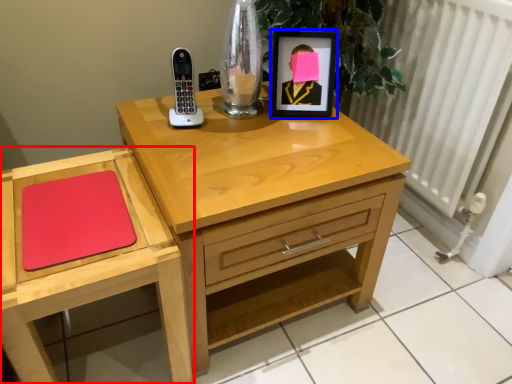
Question: Which object appears closest to the camera in this image, chest of drawers (highlighted by a red box) or picture frame (highlighted by a blue box)?

Choices:
 (A) chest of drawers
 (B) picture frame

Answer: (A)